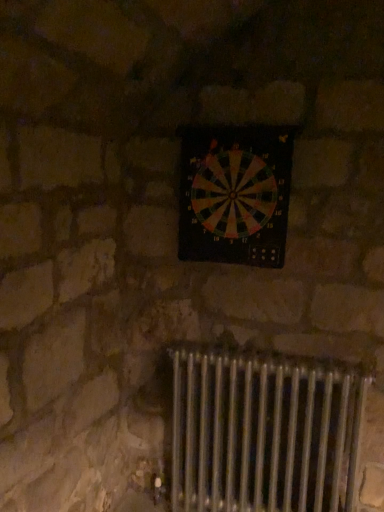
What do you see at coordinates (235, 194) in the screenshot? I see `multicolored plastic dartboard at center` at bounding box center [235, 194].

I want to click on multicolored plastic dartboard at center, so click(235, 194).

You are a GUI agent. You are given a task and a screenshot of the screen. Output one action in this format:
    pyautogui.click(x=<x>, y=<y>)
    Task: Click on the metallic radiator at lower center
    Image resolution: width=384 pixels, height=512 pixels.
    Given the screenshot: What is the action you would take?
    pyautogui.click(x=264, y=431)

In order to face metallic radiator at lower center, should I rotate leftwards or rightwards?

Rotate your view right by about 9.448°.

What do you see at coordinates (264, 431) in the screenshot? The image size is (384, 512). I see `metallic radiator at lower center` at bounding box center [264, 431].

You are a GUI agent. You are given a task and a screenshot of the screen. Output one action in this format:
    pyautogui.click(x=<x>, y=<y>)
    Task: Click on the multicolored plastic dartboard at center
    This screenshot has width=384, height=512.
    Given the screenshot: What is the action you would take?
    pyautogui.click(x=235, y=194)

Between metallic radiator at lower center and multicolored plastic dartboard at center, which one appears on the left side from the viewer's perspective?

Positioned to the left is multicolored plastic dartboard at center.

Does metallic radiator at lower center lie behind multicolored plastic dartboard at center?

No, it is not.

Which point is more forward, (317,377) or (247,140)?

Positioned in front is point (247,140).

From the image's perspective, which one is positioned higher, metallic radiator at lower center or multicolored plastic dartboard at center?

multicolored plastic dartboard at center.

From a real-world perspective, is metallic radiator at lower center physically above multicolored plastic dartboard at center?

Incorrect, from a real-world perspective, metallic radiator at lower center is lower than multicolored plastic dartboard at center.

Which of these two, metallic radiator at lower center or multicolored plastic dartboard at center, is wider?

metallic radiator at lower center is wider.

From the picture: Can you confirm if metallic radiator at lower center is shorter than multicolored plastic dartboard at center?

No, metallic radiator at lower center is not shorter than multicolored plastic dartboard at center.

Considering the sizes of metallic radiator at lower center and multicolored plastic dartboard at center in the image, is metallic radiator at lower center bigger or smaller than multicolored plastic dartboard at center?

Considering their sizes, metallic radiator at lower center takes up more space than multicolored plastic dartboard at center.

Is multicolored plastic dartboard at center inside metallic radiator at lower center?

No, multicolored plastic dartboard at center is not inside metallic radiator at lower center.

Consider the image. Is metallic radiator at lower center not close to multicolored plastic dartboard at center?

No, metallic radiator at lower center is not far away from multicolored plastic dartboard at center.

Is multicolored plastic dartboard at center at the back of metallic radiator at lower center?

No.

How many degrees apart are the facing directions of metallic radiator at lower center and multicolored plastic dartboard at center?

The facing directions of metallic radiator at lower center and multicolored plastic dartboard at center are 1.01 degrees apart.

Locate an element on the screen. The image size is (384, 512). radiator in front of the multicolored plastic dartboard at center is located at coordinates (264, 431).

Is multicolored plastic dartboard at center to the left of metallic radiator at lower center from the viewer's perspective?

Yes.

Which is in front, multicolored plastic dartboard at center or metallic radiator at lower center?

Positioned in front is metallic radiator at lower center.

Is point (225, 215) less distant than point (255, 445)?

That is True.

From the image's perspective, relative to metallic radiator at lower center, is multicolored plastic dartboard at center above or below?

multicolored plastic dartboard at center is situated higher than metallic radiator at lower center in the image.

Based on the photo, from a real-world perspective, who is located lower, multicolored plastic dartboard at center or metallic radiator at lower center?

metallic radiator at lower center.

Looking at this image, looking at their sizes, would you say multicolored plastic dartboard at center is wider or thinner than metallic radiator at lower center?

multicolored plastic dartboard at center is thinner than metallic radiator at lower center.

Considering the sizes of multicolored plastic dartboard at center and metallic radiator at lower center in the image, is multicolored plastic dartboard at center taller or shorter than metallic radiator at lower center?

multicolored plastic dartboard at center is shorter than metallic radiator at lower center.

Can you confirm if multicolored plastic dartboard at center is smaller than metallic radiator at lower center?

Indeed, multicolored plastic dartboard at center has a smaller size compared to metallic radiator at lower center.

Is multicolored plastic dartboard at center spatially inside metallic radiator at lower center, or outside of it?

multicolored plastic dartboard at center is not enclosed by metallic radiator at lower center.

Is multicolored plastic dartboard at center positioned far away from metallic radiator at lower center?

No.

Is multicolored plastic dartboard at center aimed at metallic radiator at lower center?

No, multicolored plastic dartboard at center does not turn towards metallic radiator at lower center.

Where is `radiator that is below the multicolored plastic dartboard at center (from the image's perspective)`? The image size is (384, 512). radiator that is below the multicolored plastic dartboard at center (from the image's perspective) is located at coordinates (264, 431).

Where is `wall clock behind the metallic radiator at lower center`? This screenshot has width=384, height=512. wall clock behind the metallic radiator at lower center is located at coordinates (235, 194).

This screenshot has height=512, width=384. What are the coordinates of `radiator lying on the right of multicolored plastic dartboard at center` in the screenshot? It's located at click(264, 431).